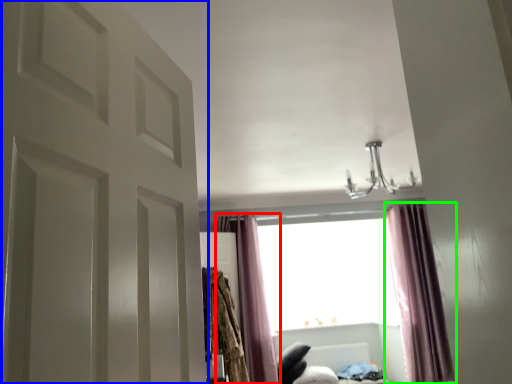
Question: Estimate the real-world distances between objects in this image. Which object is farther from curtain (highlighted by a red box), door (highlighted by a blue box) or curtain (highlighted by a green box)?

Choices:
 (A) door
 (B) curtain

Answer: (A)